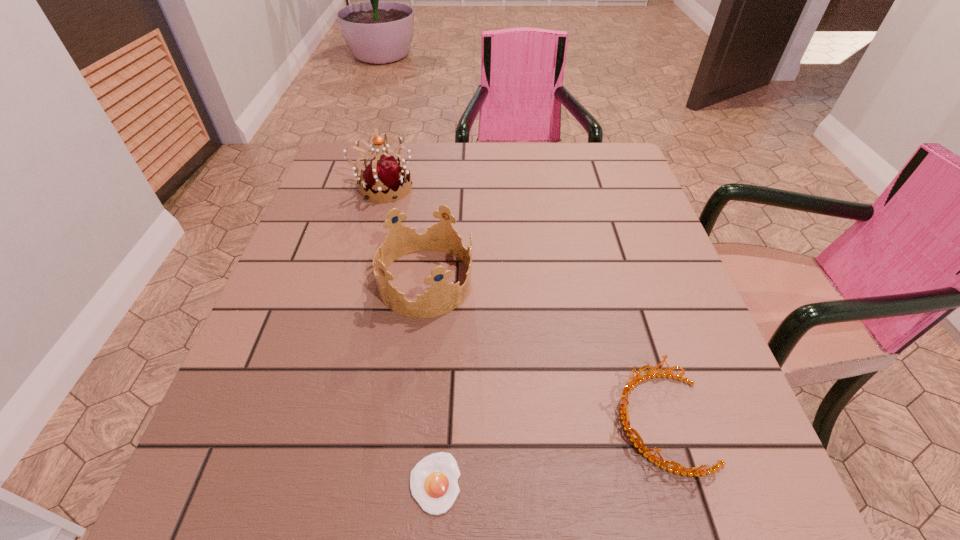
At what (x,y) coordinates should I click in order to perform the action: click on free space located on the front-facing side of the rightmost object. Please return your answer as a coordinate pair (x, y). The height and width of the screenshot is (540, 960). Looking at the image, I should click on (421, 422).

You are a GUI agent. You are given a task and a screenshot of the screen. Output one action in this format:
    pyautogui.click(x=<x>, y=<y>)
    Task: Click on the vacant space situated on the front-facing side of the rightmost object
    
    Given the screenshot: What is the action you would take?
    pyautogui.click(x=496, y=422)

You are a GUI agent. You are given a task and a screenshot of the screen. Output one action in this format:
    pyautogui.click(x=<x>, y=<y>)
    Task: Click on the vacant space positioned 0.270m on the back of the egg yolk
    The height and width of the screenshot is (540, 960).
    Given the screenshot: What is the action you would take?
    pyautogui.click(x=446, y=314)

Locate an element on the screen. This screenshot has width=960, height=540. object at the far edge is located at coordinates (384, 175).

This screenshot has height=540, width=960. I want to click on tiara located in the near edge section of the desktop, so click(x=630, y=385).

You are a GUI agent. You are given a task and a screenshot of the screen. Output one action in this format:
    pyautogui.click(x=<x>, y=<y>)
    Task: Click on the egg yolk located at the near edge
    The height and width of the screenshot is (540, 960).
    Given the screenshot: What is the action you would take?
    pyautogui.click(x=433, y=480)

I want to click on object that is at the left edge, so click(x=384, y=175).

Identify the location of object present at the right edge. Image resolution: width=960 pixels, height=540 pixels. (630, 385).

At what (x,y) coordinates should I click in order to perform the action: click on object located at the far left corner. Please return your answer as a coordinate pair (x, y). The image size is (960, 540). Looking at the image, I should click on (384, 175).

You are a GUI agent. You are given a task and a screenshot of the screen. Output one action in this format:
    pyautogui.click(x=<x>, y=<y>)
    Task: Click on the object at the near right corner
    This screenshot has width=960, height=540.
    Given the screenshot: What is the action you would take?
    pyautogui.click(x=630, y=385)